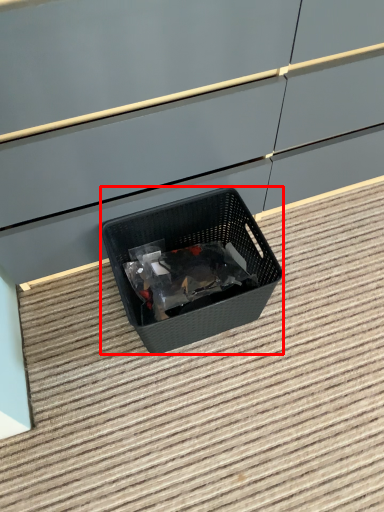
Question: From the image's perspective, where is waste container (annotated by the red box) located relative to stair?

Choices:
 (A) below
 (B) above

Answer: (B)